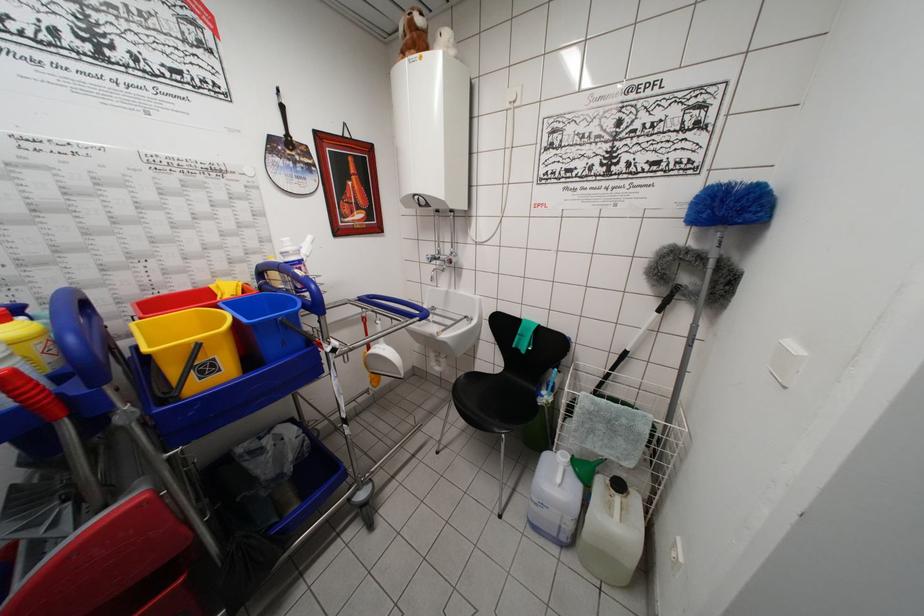
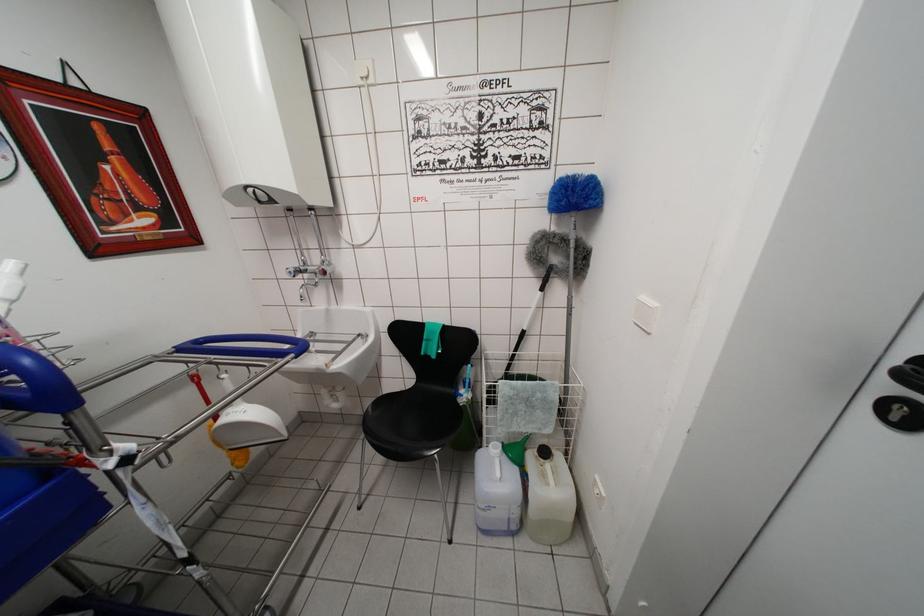
Where in the second image is the point corresponding to (563,456) from the first image?

(493, 450)